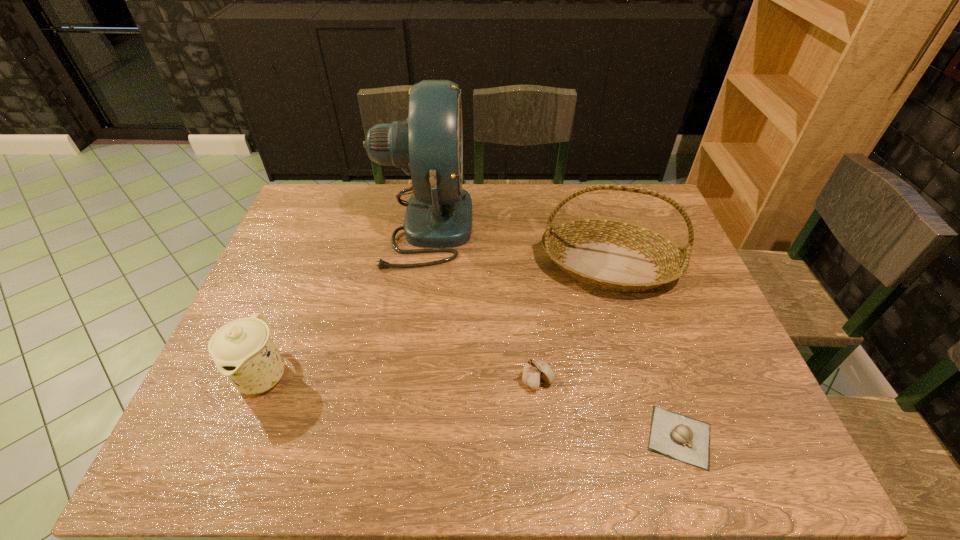
At what (x,y) coordinates should I click in order to perform the action: click on free space located on the left of the fourth shortest object. Please return your answer as a coordinate pair (x, y). Looking at the image, I should click on (523, 266).

The width and height of the screenshot is (960, 540). Find the location of `free space located 0.090m on the spout of the chinaware`. free space located 0.090m on the spout of the chinaware is located at coordinates (233, 450).

Locate an element on the screen. The height and width of the screenshot is (540, 960). vacant space located 0.050m on the back of the fourth tallest object is located at coordinates (534, 350).

You are a GUI agent. You are given a task and a screenshot of the screen. Output one action in this format:
    pyautogui.click(x=<x>, y=<y>)
    Task: Click on the vacant space located 0.220m on the left of the shortest object
    
    Given the screenshot: What is the action you would take?
    pyautogui.click(x=538, y=437)

At what (x,y) coordinates should I click in order to perform the action: click on object at the far edge. Please return your answer as a coordinate pair (x, y). This screenshot has height=540, width=960. Looking at the image, I should click on (428, 146).

Image resolution: width=960 pixels, height=540 pixels. In order to click on object that is at the near edge in this screenshot , I will do coord(674,435).

Where is `object positioned at the left edge`? The image size is (960, 540). object positioned at the left edge is located at coordinates tap(243, 350).

The width and height of the screenshot is (960, 540). In order to click on basket present at the right edge in this screenshot , I will do (x=616, y=255).

At what (x,y) coordinates should I click in order to perform the action: click on garlic that is at the right edge. Please return your answer as a coordinate pair (x, y). The width and height of the screenshot is (960, 540). Looking at the image, I should click on (674, 435).

Locate an element on the screen. This screenshot has width=960, height=540. object that is at the near right corner is located at coordinates (674, 435).